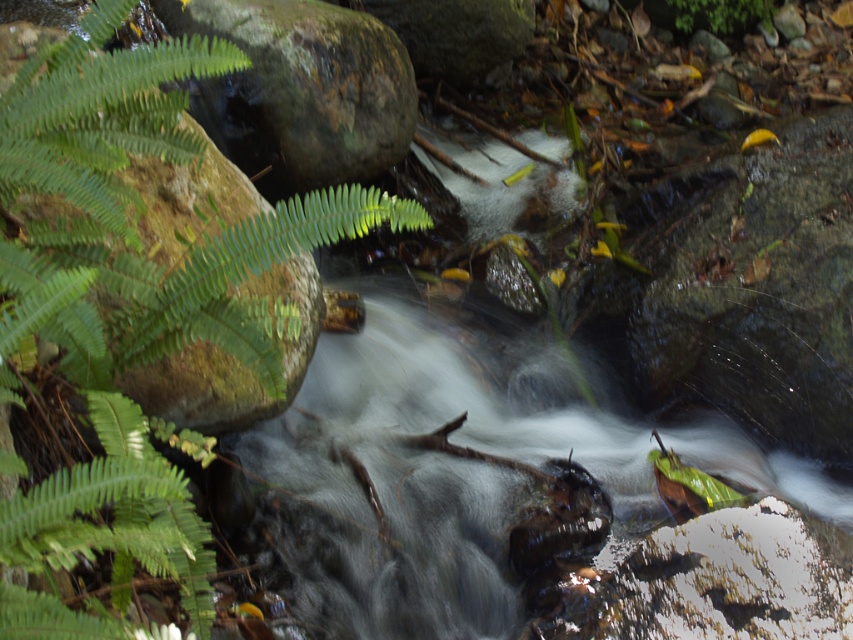
Question: Is green leafy fern at upper left smaller than green leafy plant at upper right?

Choices:
 (A) yes
 (B) no

Answer: (B)

Question: Which point is closer to the camera?

Choices:
 (A) (221, 246)
 (B) (694, 22)

Answer: (A)

Question: Is green leafy fern at upper left above green mossy rock at center-left?

Choices:
 (A) yes
 (B) no

Answer: (B)

Question: Can you confirm if green mossy rock at center-left is thinner than green leafy plant at upper right?

Choices:
 (A) no
 (B) yes

Answer: (A)

Question: Which object appears farthest from the camera in this image?

Choices:
 (A) green leafy fern at upper left
 (B) green leafy plant at upper right

Answer: (B)

Question: Based on their relative distances, which object is farther from the green leafy fern at upper left?

Choices:
 (A) green mossy rock at center-left
 (B) green leafy plant at upper right

Answer: (B)